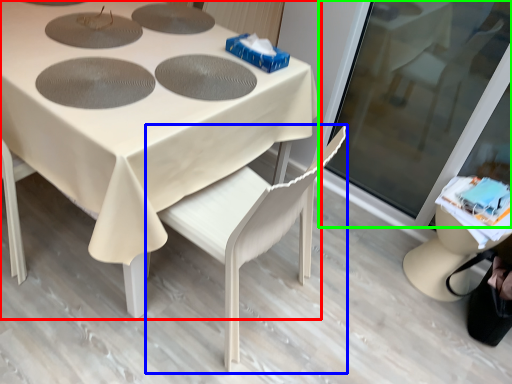
Question: Which is farther away from table (highlighted by a red box)? chair (highlighted by a blue box) or screen door (highlighted by a green box)?

Choices:
 (A) chair
 (B) screen door

Answer: (B)